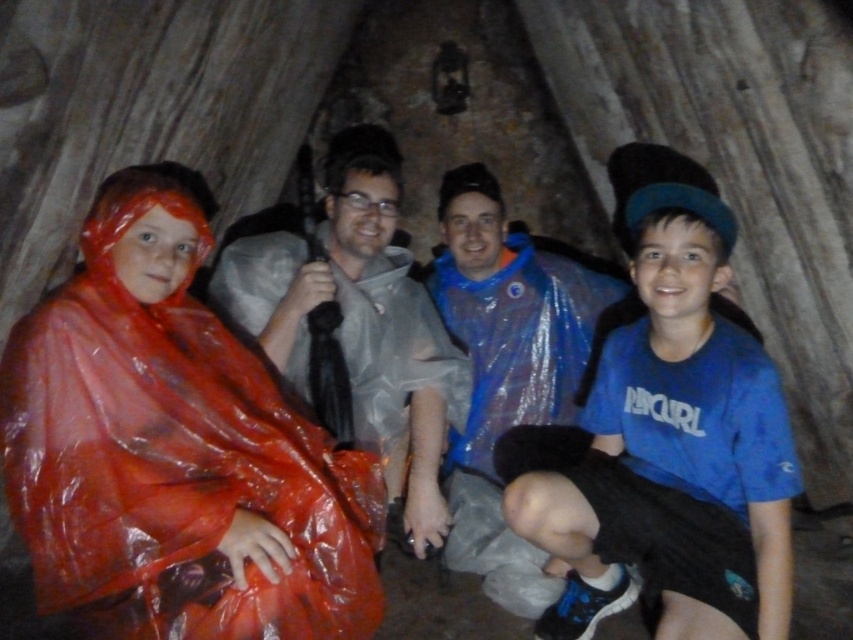
In the scene shown: You are part of a group exploring a cave and need to pass through a narrow passage ahead. You notice the blue cotton shirt at center and the matte gray raincoat at center. Which clothing item is closer to you, and would it block your path?

The blue cotton shirt at center is in front of the matte gray raincoat at center, so it is closer to you and would block your path.

You are part of a hiking group in a cave. You need to locate the blue cotton shirt at center and the matte gray raincoat at center. Which one is positioned to the right of the other?

The blue cotton shirt at center is to the right of the matte gray raincoat at center.